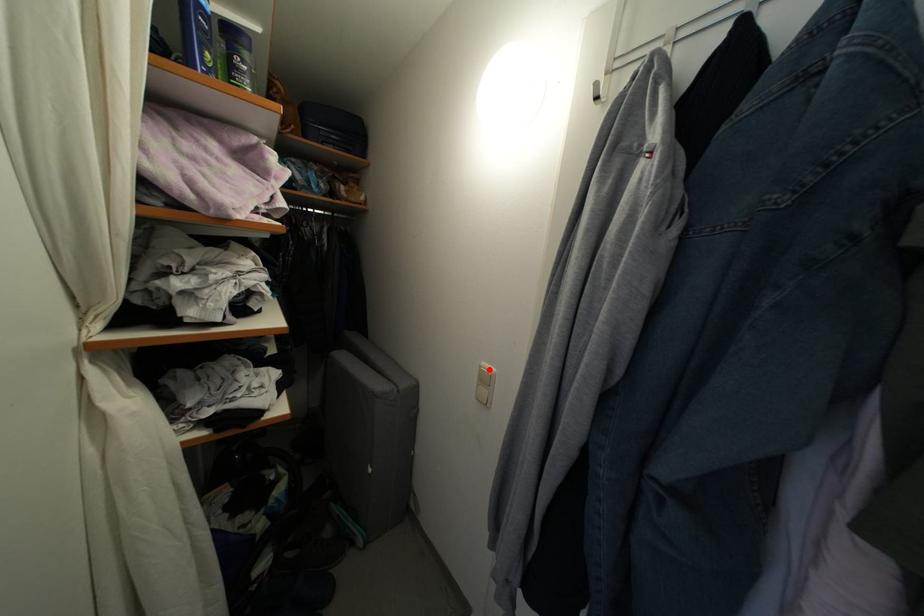
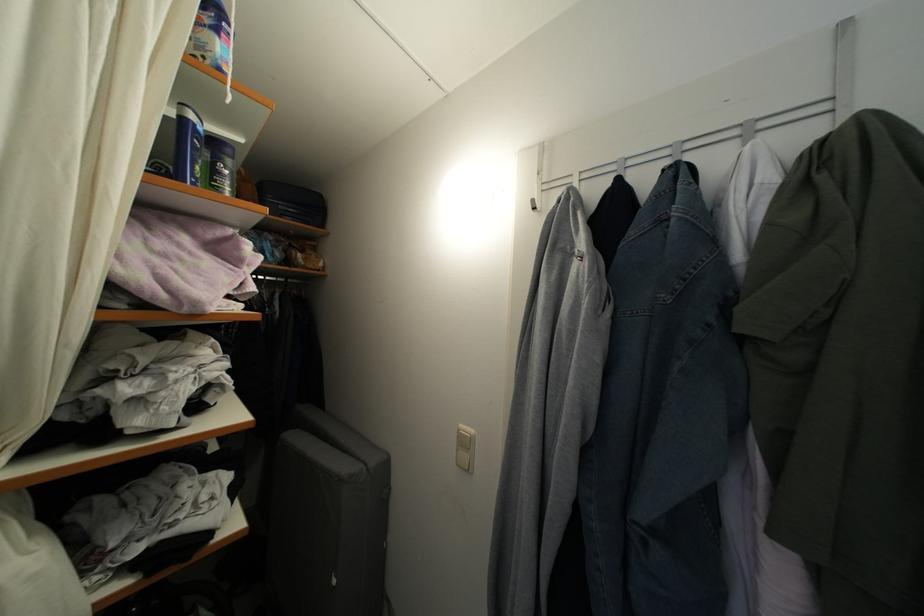
Find the pixel in the second image that matches the highlighted location in the first image.

(467, 432)